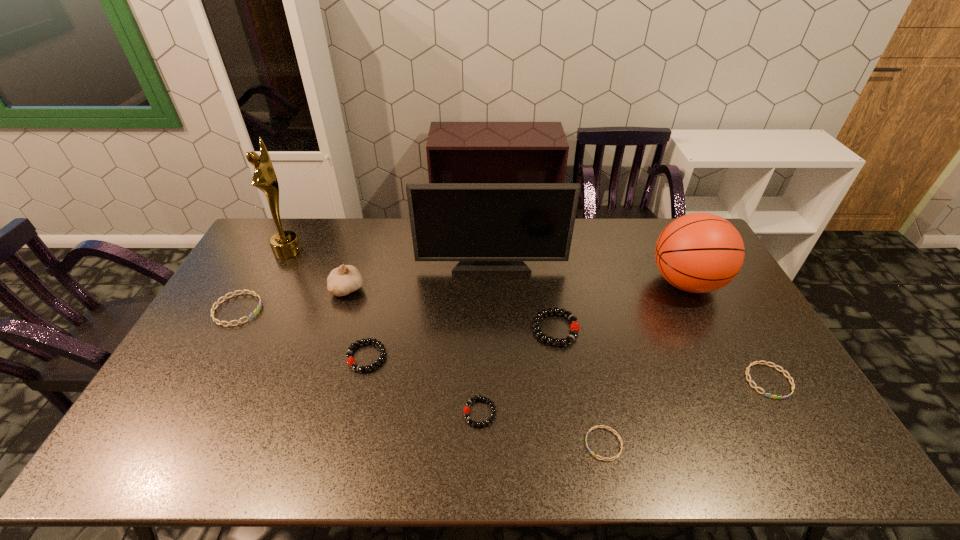
Identify the location of award present at the far edge. [x=285, y=244].

This screenshot has width=960, height=540. I want to click on monitor that is positioned at the far edge, so click(x=490, y=228).

Find the location of `object located at the near edge`. object located at the near edge is located at coordinates (615, 457).

At what (x,y) coordinates should I click in order to perform the action: click on award at the left edge. Please return your answer as a coordinate pair (x, y). Looking at the image, I should click on (285, 244).

What are the coordinates of `bracelet that is at the left edge` in the screenshot? It's located at (251, 315).

This screenshot has width=960, height=540. In order to click on basketball that is positioned at the right edge in this screenshot , I will do `click(700, 252)`.

This screenshot has width=960, height=540. Identify the location of bracelet that is at the right edge. (750, 381).

Image resolution: width=960 pixels, height=540 pixels. Identify the location of object at the far left corner. (285, 244).

What are the coordinates of `free point at the far edge` in the screenshot? It's located at (654, 237).

The image size is (960, 540). In the image, there is a desktop. Identify the location of vacant space at the left edge. tap(225, 359).